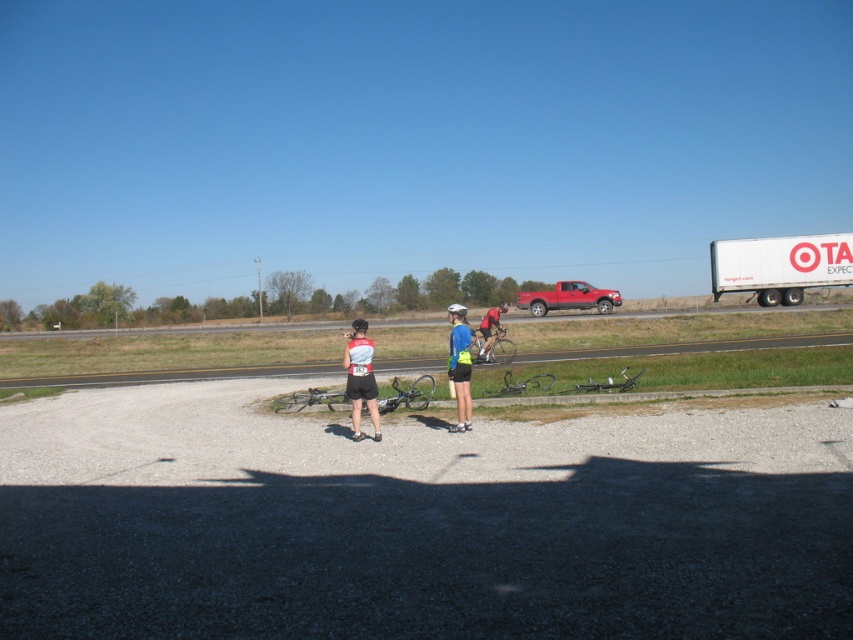
From the picture: You are a photographer positioned to the side of the cyclists. You want to take a photo that includes both the white and red athletic jersey at center and the blue fabric shirt at center. Which jersey should you position to the left side of your frame to ensure both are visible?

To ensure both the white and red athletic jersey at center and the blue fabric shirt at center are visible in your photo, position the white and red athletic jersey at center to the left side of your frame since it is already to the left of the blue fabric shirt at center in the scene.

You are a photographer positioned behind the three individuals in the gravel area. You want to take a photo that includes both the blue fabric shirt at center and the white matte bicycle helmet at center. Which object should you adjust your focus on to ensure both are in the same focal plane?

Since the blue fabric shirt at center is in front of the white matte bicycle helmet at center, you should focus on the blue fabric shirt at center to ensure both are in the same focal plane because it is closer to the camera.